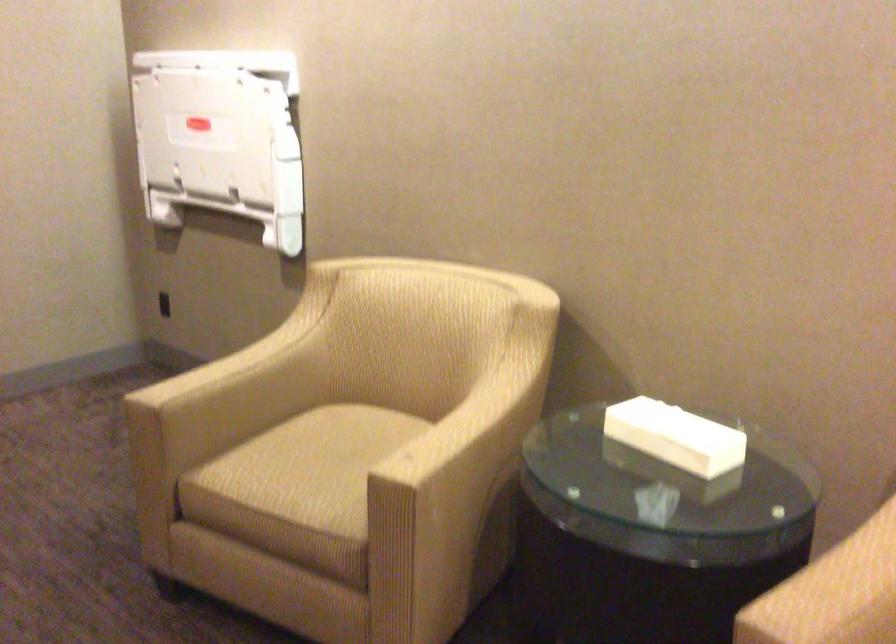
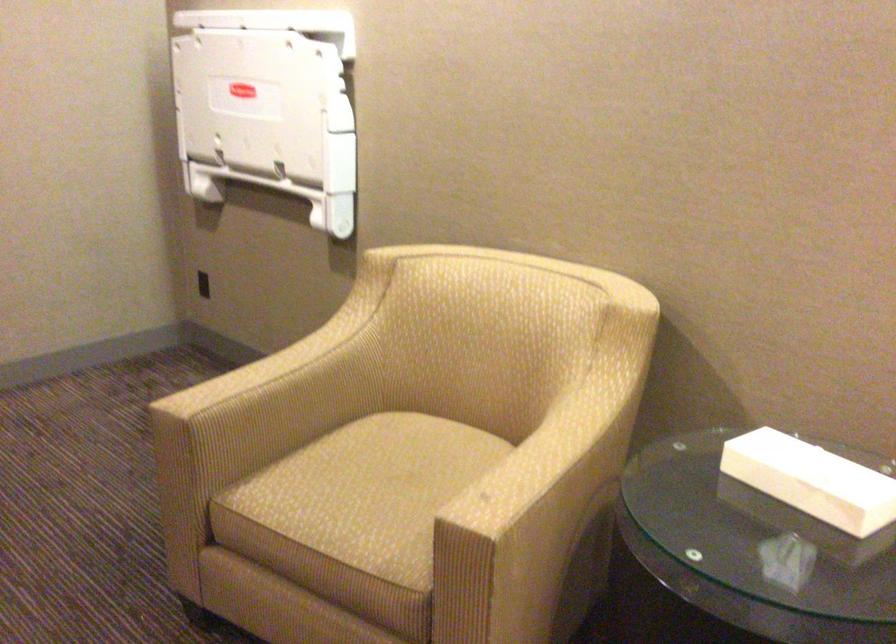
In the second image, find the point that corresponds to [480,406] in the first image.

(565, 426)